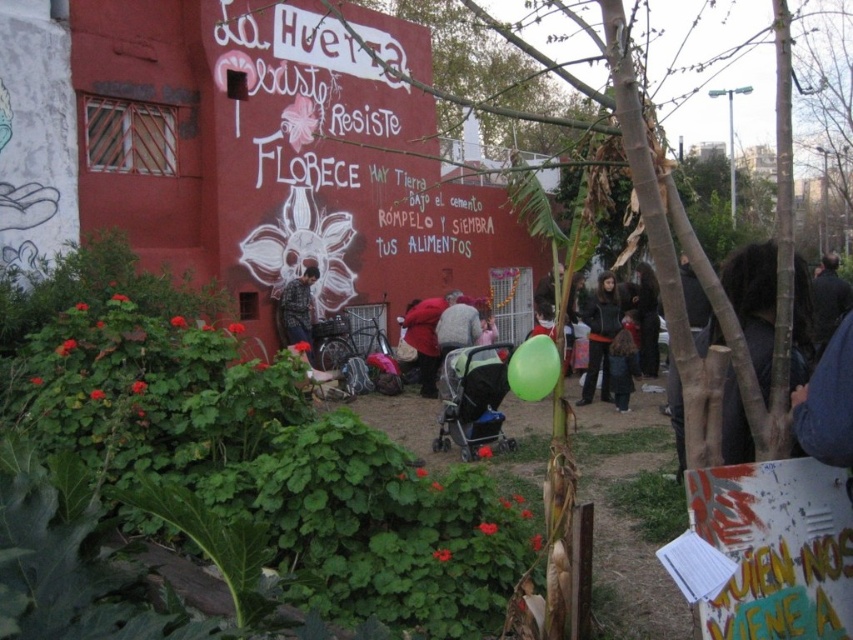
Between painted cardboard sign at center and black fabric stroller at center, which one appears on the right side from the viewer's perspective?

From the viewer's perspective, painted cardboard sign at center appears more on the right side.

Between painted cardboard sign at center and black fabric stroller at center, which one is positioned higher?

painted cardboard sign at center

Between point (805, 536) and point (469, 406), which one is positioned in front?

Point (805, 536) is more forward.

Find the location of a particular element. This screenshot has width=853, height=640. painted cardboard sign at center is located at coordinates (776, 548).

Between dark gray sweater at center and green rubber balloon at center, which one is positioned lower?

Positioned lower is green rubber balloon at center.

Between dark gray sweater at center and green rubber balloon at center, which one appears on the right side from the viewer's perspective?

dark gray sweater at center is more to the right.

Is point (608, 333) behind point (543, 387)?

Yes.

Identify the location of dark gray sweater at center. (601, 337).

Between point (585, 397) and point (415, 328), which one is positioned behind?

Point (415, 328)

Between dark gray sweater at center and red matte jacket at center, which one is positioned higher?

red matte jacket at center is above.

Between point (598, 346) and point (424, 346), which one is positioned in front?

Point (598, 346) is more forward.

This screenshot has height=640, width=853. In order to click on dark gray sweater at center in this screenshot , I will do `click(601, 337)`.